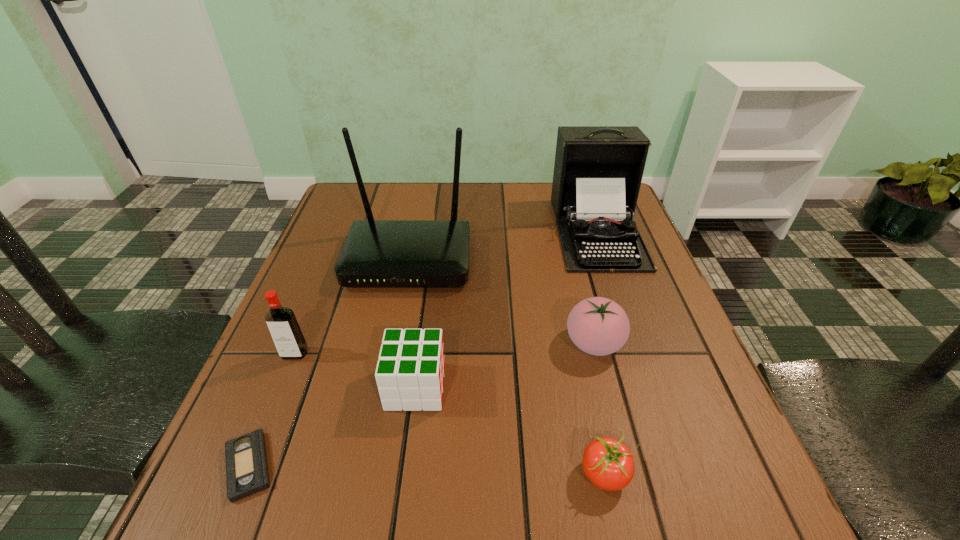
The height and width of the screenshot is (540, 960). I want to click on free space located on the front and back of the vodka, so click(x=242, y=486).

Locate an element on the screen. Image resolution: width=960 pixels, height=540 pixels. free space located 0.120m on the left of the farther tomato is located at coordinates (505, 343).

Find the location of `blank space located on the red face of the cube`. blank space located on the red face of the cube is located at coordinates (580, 387).

The image size is (960, 540). What are the coordinates of `vacant space located on the back of the nearer tomato` in the screenshot? It's located at (588, 389).

Image resolution: width=960 pixels, height=540 pixels. I want to click on vacant position located on the back of the videotape, so click(x=324, y=280).

Identify the location of object that is at the far edge. (598, 170).

At what (x,y) coordinates should I click in order to perform the action: click on tomato at the near edge. Please return your answer as a coordinate pair (x, y). Looking at the image, I should click on (608, 463).

Locate an element on the screen. The image size is (960, 540). videotape present at the near edge is located at coordinates (247, 473).

Locate an element on the screen. Image resolution: width=960 pixels, height=540 pixels. router that is positioned at the left edge is located at coordinates (376, 253).

I want to click on vodka located at the left edge, so click(x=285, y=331).